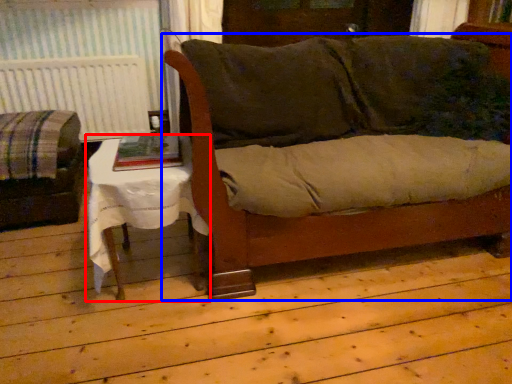
Question: Which point is further to the camera, table (highlighted by a red box) or couch (highlighted by a blue box)?

Choices:
 (A) table
 (B) couch

Answer: (A)